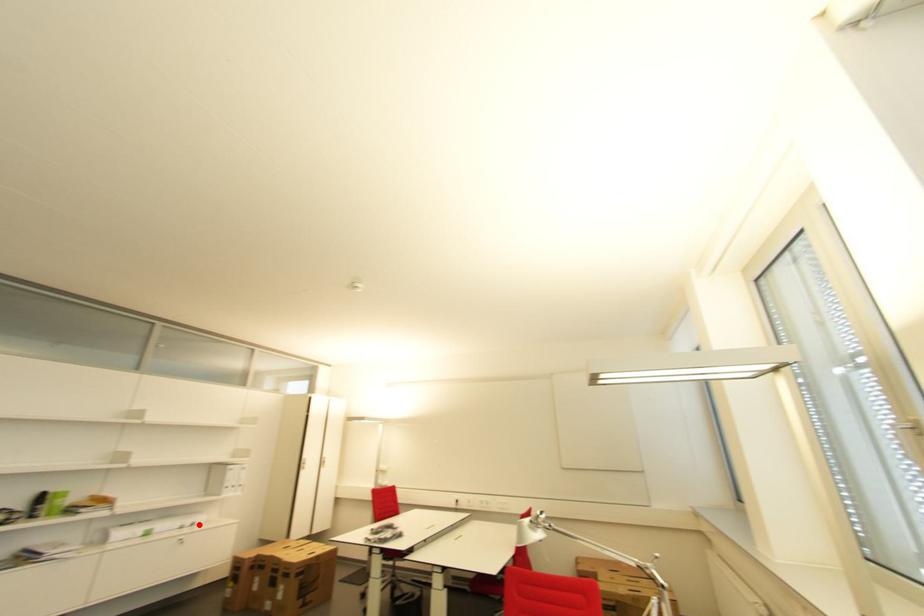
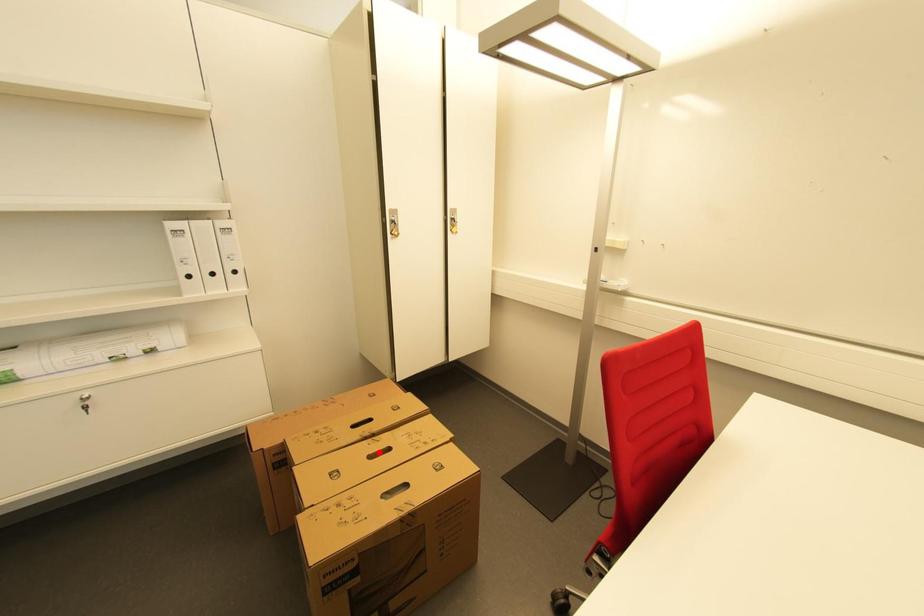
I am providing you with two images of the same scene from different viewpoints. A red point is marked on the first image and another point is marked on the second image. Is the marked point in image1 the same physical position as the marked point in image2?

No